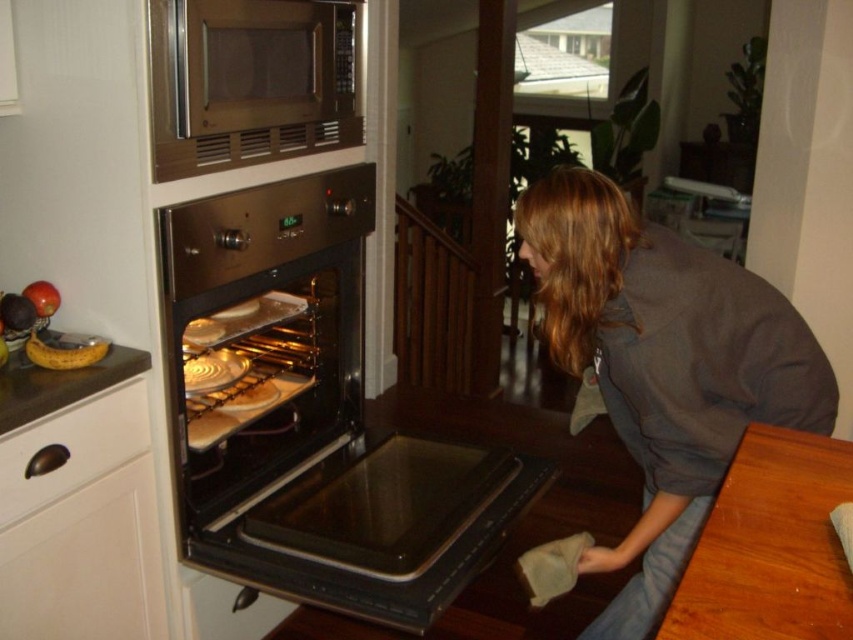
Can you confirm if metallic silver microwave at upper center is thinner than yellow matte banana at left?

No, metallic silver microwave at upper center is not thinner than yellow matte banana at left.

Measure the distance between metallic silver microwave at upper center and camera.

A distance of 1.35 meters exists between metallic silver microwave at upper center and camera.

Is point (200, 170) more distant than point (51, 353)?

Yes, point (200, 170) is farther from viewer.

What are the coordinates of `metallic silver microwave at upper center` in the screenshot? It's located at (251, 81).

Does stainless steel oven at center have a lesser width compared to yellow matte banana at left?

In fact, stainless steel oven at center might be wider than yellow matte banana at left.

Is the position of stainless steel oven at center less distant than that of yellow matte banana at left?

Yes.

This screenshot has width=853, height=640. Describe the element at coordinates (291, 396) in the screenshot. I see `stainless steel oven at center` at that location.

Find the location of a particular element. stainless steel oven at center is located at coordinates (291, 396).

This screenshot has width=853, height=640. I want to click on dark gray sweatshirt at lower right, so click(x=663, y=365).

Which is in front, point (757, 289) or point (50, 348)?

Point (757, 289)

At what (x,y) coordinates should I click in order to perform the action: click on dark gray sweatshirt at lower right. Please return your answer as a coordinate pair (x, y). The height and width of the screenshot is (640, 853). Looking at the image, I should click on (663, 365).